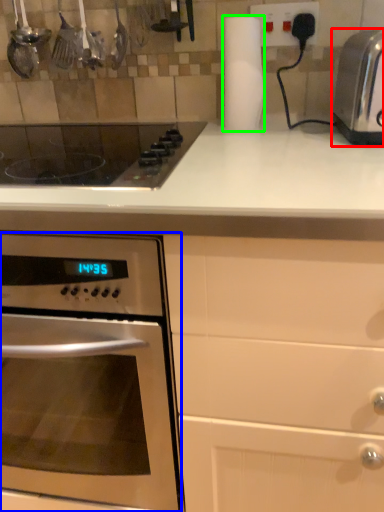
Question: Which object is the farthest from toaster (highlighted by a red box)? Choose among these: oven (highlighted by a blue box) or paper towel (highlighted by a green box).

Choices:
 (A) oven
 (B) paper towel

Answer: (A)